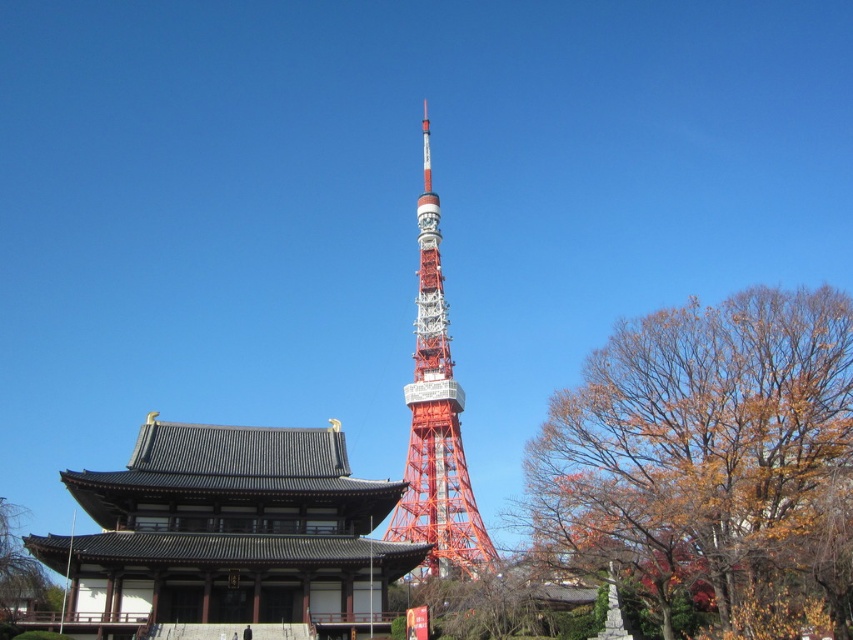
Question: Which object is the closest to the autumn leaves at right?

Choices:
 (A) orange metallic tower at center
 (B) shiny black wood temple at lower left

Answer: (A)

Question: Which is nearer to the shiny black wood temple at lower left?

Choices:
 (A) autumn leaves at right
 (B) orange metallic tower at center

Answer: (B)

Question: Can you confirm if shiny black wood temple at lower left is smaller than orange metallic tower at center?

Choices:
 (A) yes
 (B) no

Answer: (A)

Question: Where is autumn leaves at right located in relation to shiny black wood temple at lower left in the image?

Choices:
 (A) right
 (B) left

Answer: (A)

Question: Can you confirm if autumn leaves at right is wider than orange metallic tower at center?

Choices:
 (A) no
 (B) yes

Answer: (B)

Question: Which point appears farthest from the camera in this image?

Choices:
 (A) (418, 216)
 (B) (125, 596)

Answer: (A)